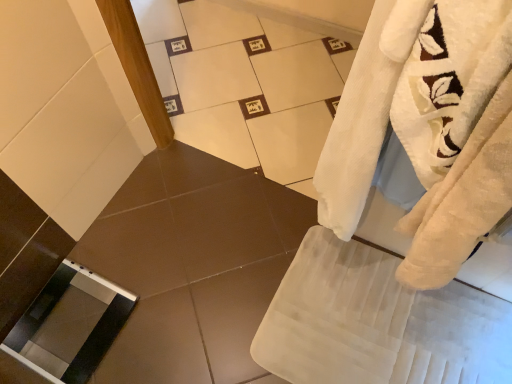
Question: Considering the positions of point (66, 332) and point (309, 264), is point (66, 332) closer or farther from the camera than point (309, 264)?

Choices:
 (A) closer
 (B) farther

Answer: (A)

Question: Considering the positions of clear glass screen door at lower left and white soft bath towel at lower right in the image, is clear glass screen door at lower left bigger or smaller than white soft bath towel at lower right?

Choices:
 (A) small
 (B) big

Answer: (A)

Question: From the image's perspective, relative to white soft bath towel at lower right, is clear glass screen door at lower left above or below?

Choices:
 (A) below
 (B) above

Answer: (B)

Question: Is white soft bath towel at lower right inside the boundaries of clear glass screen door at lower left, or outside?

Choices:
 (A) outside
 (B) inside

Answer: (A)

Question: Considering the positions of white soft bath towel at lower right and clear glass screen door at lower left in the image, is white soft bath towel at lower right wider or thinner than clear glass screen door at lower left?

Choices:
 (A) thin
 (B) wide

Answer: (B)

Question: From their relative heights in the image, would you say white soft bath towel at lower right is taller or shorter than clear glass screen door at lower left?

Choices:
 (A) tall
 (B) short

Answer: (A)

Question: From a real-world perspective, relative to clear glass screen door at lower left, is white soft bath towel at lower right vertically above or below?

Choices:
 (A) below
 (B) above

Answer: (B)